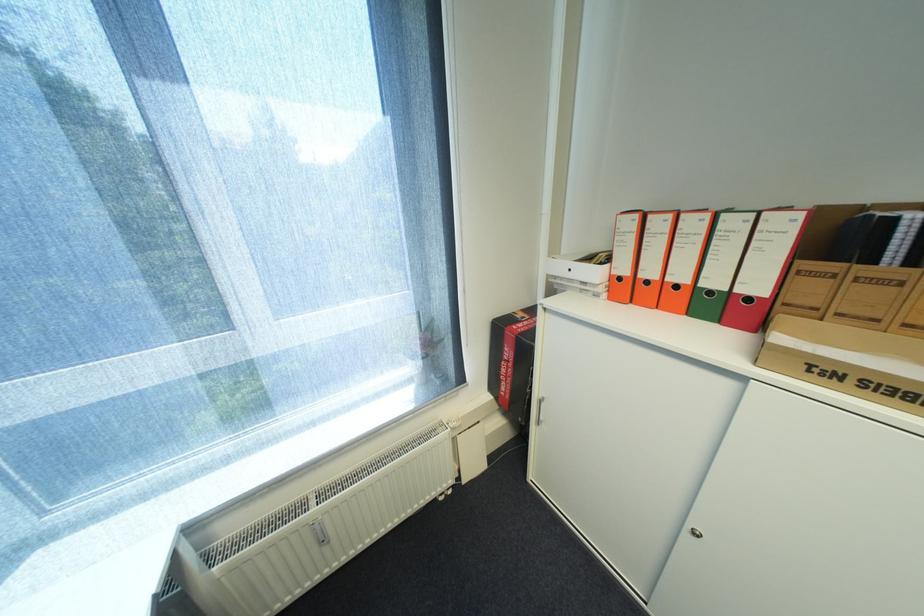
Where would you slid the cabinet door handle? Please return your answer as a coordinate pair (x, y).

(696, 533)